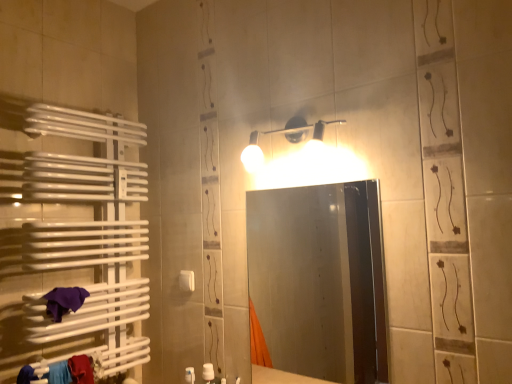
At what (x,y) coordinates should I click in order to perform the action: click on white plastic towel bar at lower left. Please return your answer as a coordinate pair (x, y). This screenshot has width=512, height=384. Looking at the image, I should click on (187, 280).

Consider the image. Which of these two, smooth glass mirror at center or matte white light fixture at upper center, is bigger?

smooth glass mirror at center is bigger.

Relative to matte white light fixture at upper center, is smooth glass mirror at center in front or behind?

In the image, smooth glass mirror at center appears in front of matte white light fixture at upper center.

How much distance is there between smooth glass mirror at center and matte white light fixture at upper center?

A distance of 5.58 feet exists between smooth glass mirror at center and matte white light fixture at upper center.

From the image's perspective, is smooth glass mirror at center on top of matte white light fixture at upper center?

No.

Is smooth glass mirror at center at the right side of white plastic towel bar at lower left?

Correct, you'll find smooth glass mirror at center to the right of white plastic towel bar at lower left.

Is smooth glass mirror at center thinner than white plastic towel bar at lower left?

In fact, smooth glass mirror at center might be wider than white plastic towel bar at lower left.

Does smooth glass mirror at center have a larger size compared to white plastic towel bar at lower left?

Yes.

From the image's perspective, between matte white light fixture at upper center and smooth glass mirror at center, who is located below?

smooth glass mirror at center.

Looking at this image, is matte white light fixture at upper center facing away from smooth glass mirror at center?

matte white light fixture at upper center is not turned away from smooth glass mirror at center.

Considering the sizes of objects matte white light fixture at upper center and smooth glass mirror at center in the image provided, who is thinner, matte white light fixture at upper center or smooth glass mirror at center?

smooth glass mirror at center.

From the image's perspective, would you say purple cloth at lower left is shown under white plastic towel bar at lower left?

Yes, from the image's perspective, purple cloth at lower left is below white plastic towel bar at lower left.

From a real-world perspective, between purple cloth at lower left and white plastic towel bar at lower left, who is vertically lower?

purple cloth at lower left is physically lower.

The image size is (512, 384). I want to click on towel bar above the purple cloth at lower left (from the image's perspective), so click(187, 280).

Is white plastic towel bar at lower left positioned behind purple cloth at lower left?

Yes, white plastic towel bar at lower left is behind purple cloth at lower left.

Are white plastic towel bar at lower left and purple cloth at lower left located far from each other?

white plastic towel bar at lower left is actually quite close to purple cloth at lower left.

Which point is more distant from viewer, (188,276) or (47,304)?

Positioned behind is point (188,276).

At what (x,y) coordinates should I click in order to perform the action: click on light fixture above the white plastic towel bar at lower left (from the image's perspective). Please return your answer as a coordinate pair (x, y). This screenshot has height=384, width=512. Looking at the image, I should click on (286, 135).

How much distance is there between white plastic towel bar at lower left and matte white light fixture at upper center?

24.95 inches.

Is white plastic towel bar at lower left wider than matte white light fixture at upper center?

In fact, white plastic towel bar at lower left might be narrower than matte white light fixture at upper center.

Does purple cloth at lower left turn towards smooth glass mirror at center?

No, purple cloth at lower left is not oriented towards smooth glass mirror at center.

Considering the positions of objects purple cloth at lower left and smooth glass mirror at center in the image provided, who is more to the left, purple cloth at lower left or smooth glass mirror at center?

From the viewer's perspective, purple cloth at lower left appears more on the left side.

From the image's perspective, is purple cloth at lower left below smooth glass mirror at center?

Correct, purple cloth at lower left appears lower than smooth glass mirror at center in the image.

Identify the location of bath towel below the smooth glass mirror at center (from a real-world perspective). (64, 301).

Locate an element on the screen. Image resolution: width=512 pixels, height=384 pixels. light fixture above the smooth glass mirror at center (from a real-world perspective) is located at coordinates pyautogui.click(x=286, y=135).

Locate an element on the screen. towel bar behind the smooth glass mirror at center is located at coordinates (187, 280).

Looking at the image, which one is located closer to smooth glass mirror at center, matte white light fixture at upper center or purple cloth at lower left?

matte white light fixture at upper center lies closer to smooth glass mirror at center than the other object.

When comparing their distances from matte white light fixture at upper center, does smooth glass mirror at center or purple cloth at lower left seem further?

smooth glass mirror at center.

Consider the image. Considering their positions, is smooth glass mirror at center positioned closer to white plastic towel bar at lower left than purple cloth at lower left?

The object closer to white plastic towel bar at lower left is purple cloth at lower left.

Considering their positions, is white plastic towel bar at lower left positioned closer to purple cloth at lower left than matte white light fixture at upper center?

white plastic towel bar at lower left lies closer to purple cloth at lower left than the other object.

Looking at the image, which one is located further to matte white light fixture at upper center, white plastic towel bar at lower left or purple cloth at lower left?

Based on the image, purple cloth at lower left appears to be further to matte white light fixture at upper center.

From the picture: Based on their spatial positions, is purple cloth at lower left or smooth glass mirror at center closer to white plastic towel bar at lower left?

Based on the image, purple cloth at lower left appears to be nearer to white plastic towel bar at lower left.

Based on the photo, looking at the image, which one is located closer to white plastic towel bar at lower left, matte white light fixture at upper center or smooth glass mirror at center?

matte white light fixture at upper center is positioned closer to the anchor white plastic towel bar at lower left.

Looking at the image, which one is located closer to white plastic towel bar at lower left, smooth glass mirror at center or matte white light fixture at upper center?

matte white light fixture at upper center is positioned closer to the anchor white plastic towel bar at lower left.

Find the location of `light fixture between smooth glass mirror at center and white plastic towel bar at lower left along the z-axis`. light fixture between smooth glass mirror at center and white plastic towel bar at lower left along the z-axis is located at coordinates (286, 135).

This screenshot has height=384, width=512. I want to click on light fixture situated between purple cloth at lower left and smooth glass mirror at center from left to right, so click(286, 135).

Find the location of `towel bar between purple cloth at lower left and matte white light fixture at upper center from left to right`. towel bar between purple cloth at lower left and matte white light fixture at upper center from left to right is located at coordinates pos(187,280).

Locate an element on the screen. The height and width of the screenshot is (384, 512). towel bar located between purple cloth at lower left and smooth glass mirror at center in the left-right direction is located at coordinates (187, 280).